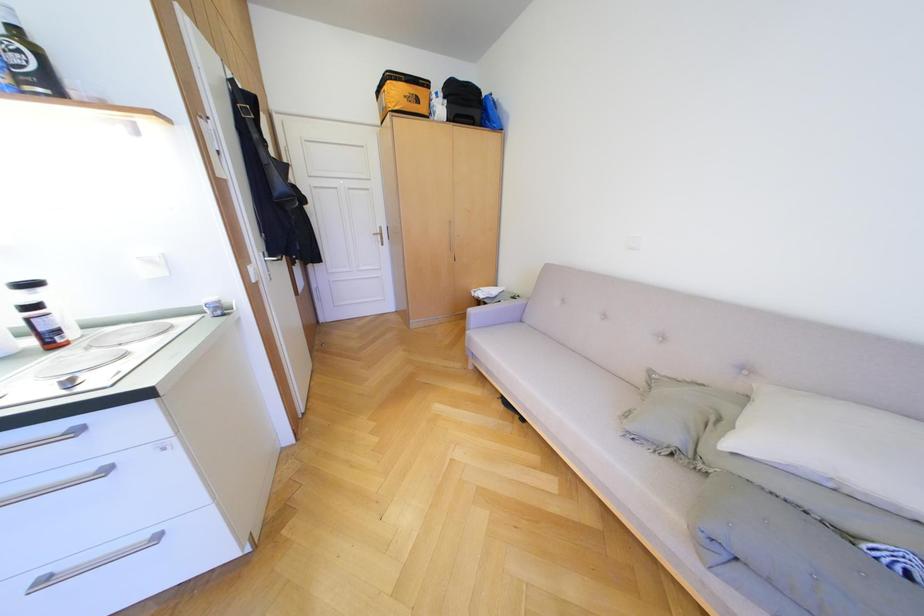
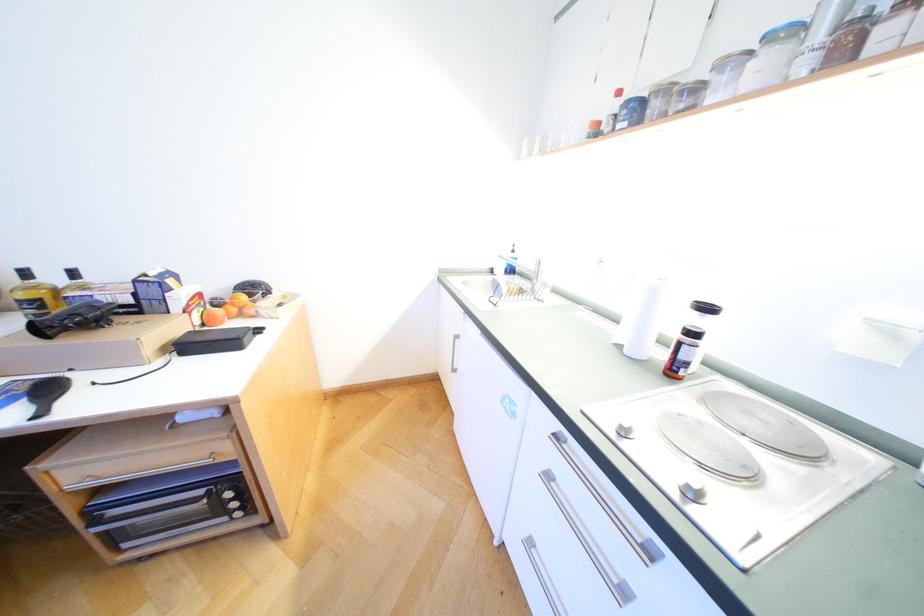
From the picture: The images are taken continuously from a first-person perspective. In which direction is your viewpoint rotating?

The camera rotated toward left-down.